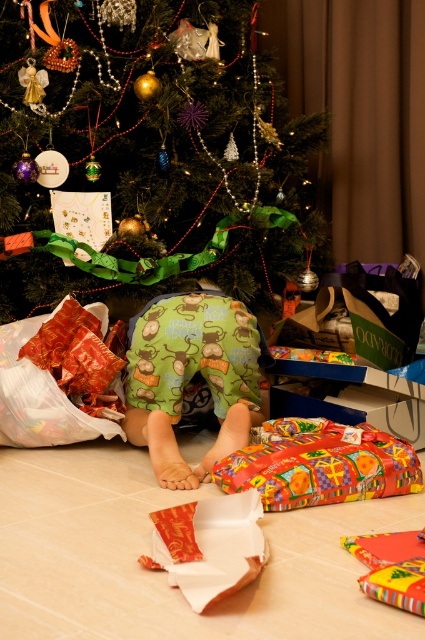
You are a curious cat observing the festive Christmas scene. You notice the shiny metallic ornaments at upper center and the multicolored glossy paper at lower center. Which object is located higher up in the image?

The shiny metallic ornaments at upper center are positioned higher up than the multicolored glossy paper at lower center.

You are a guest at a Christmas party and notice the shiny metallic ornaments at upper center and the multicolored glossy paper at lower center. Which of these items is located to the left of the other?

The shiny metallic ornaments at upper center are positioned to the left of the multicolored glossy paper at lower center.

You are a guest at a Christmas party and see the green fabric pants at center and the shiny gold paper at lower center. Which object is positioned to the left of the other?

The green fabric pants at center are to the left of the shiny gold paper at lower center.